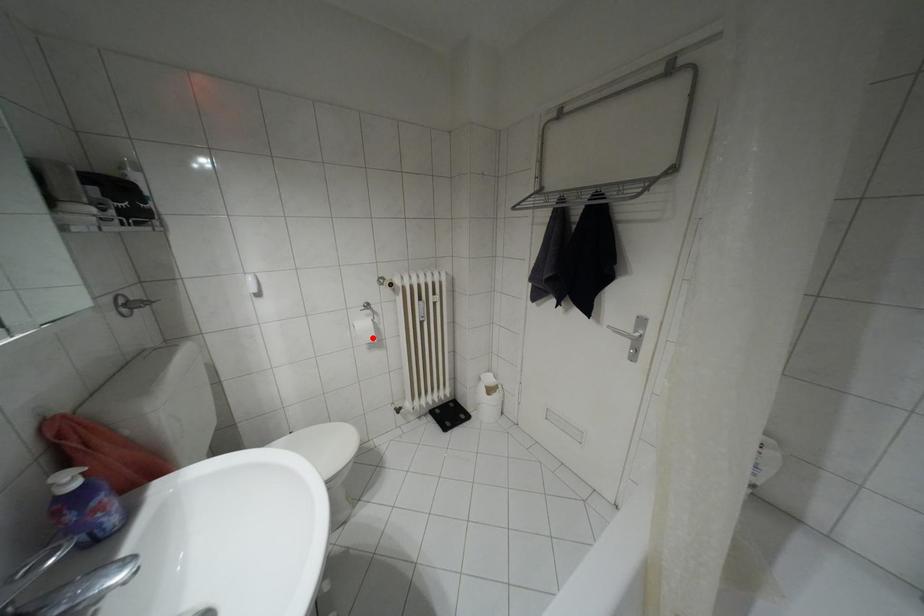
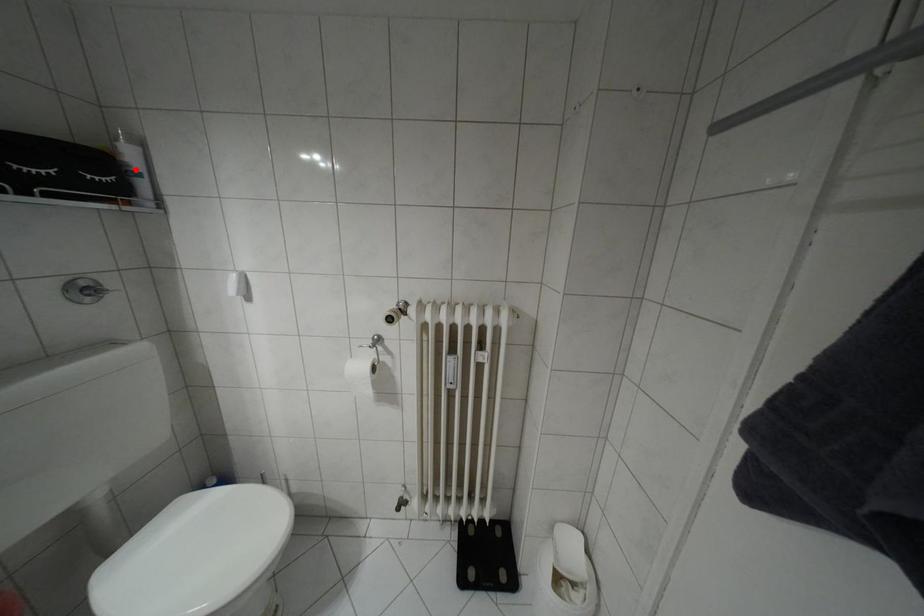
I am providing you with two images of the same scene from different viewpoints. A red point is marked on the first image and another point is marked on the second image. Does the point marked in image1 correspond to the same location as the one in image2?

No